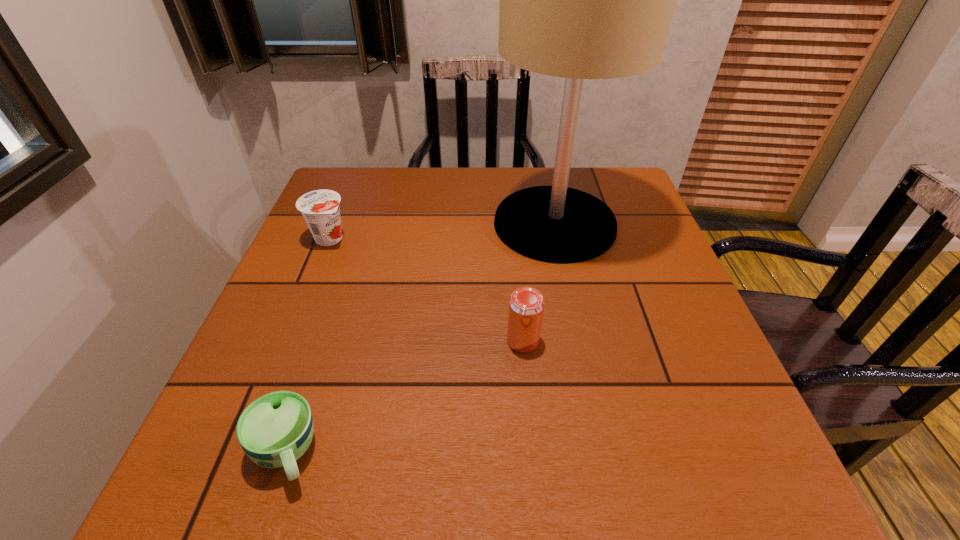
I want to click on the tallest object, so click(580, 0).

I want to click on beer can, so click(526, 304).

This screenshot has width=960, height=540. I want to click on yogurt, so click(320, 208).

Find the location of a particular element. The image size is (960, 540). the shortest object is located at coordinates (276, 429).

Where is `cup`? cup is located at coordinates click(276, 429).

Find the location of a particular element. free space located on the left of the tallest object is located at coordinates (371, 224).

Where is `free space located 0.150m on the back of the beer can`? free space located 0.150m on the back of the beer can is located at coordinates (517, 276).

Locate an element on the screen. free spot located on the front of the yogurt is located at coordinates (280, 359).

Locate an element on the screen. The image size is (960, 540). free space located 0.230m on the right of the cup is located at coordinates (468, 452).

The height and width of the screenshot is (540, 960). I want to click on object that is at the far edge, so click(580, 0).